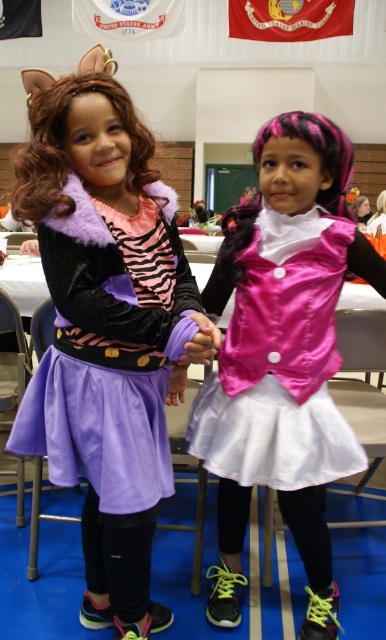
You are a photographer setting up for a school event. You need to ensure that the pink satin vest at center is visible in the photo without being blocked by the metallic silver chair at lower center. Can you confirm if the vest is above or below the chair?

The pink satin vest at center is positioned over the metallic silver chair at lower center, meaning it is above the chair and will not be blocked.

Based on the photo, you are a costume designer looking at the image of two children in costumes. You need to determine the vertical positioning of the purple velvet dress at center and the pink satin vest at center. Which one is higher up in the image?

The purple velvet dress at center is located above the pink satin vest at center, so it is higher up in the image.